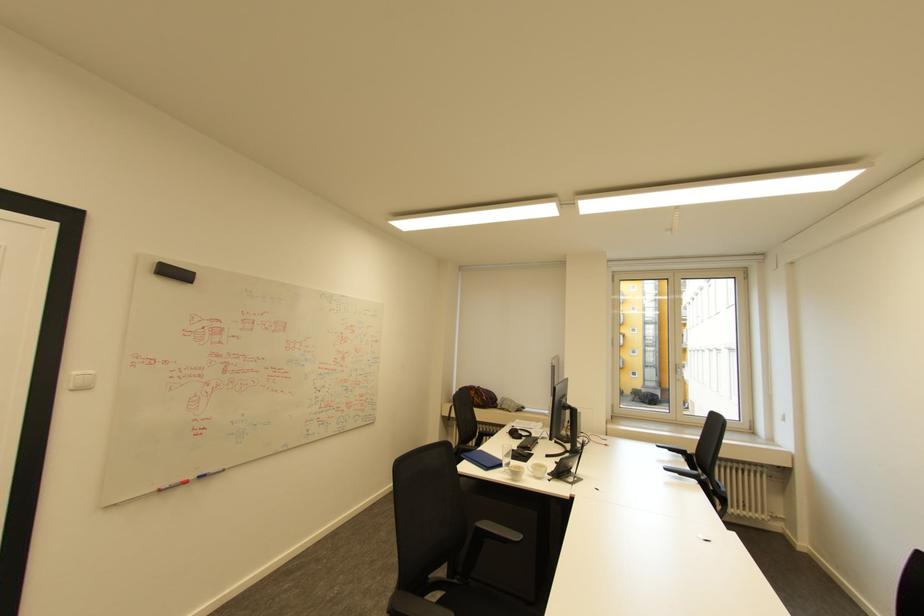
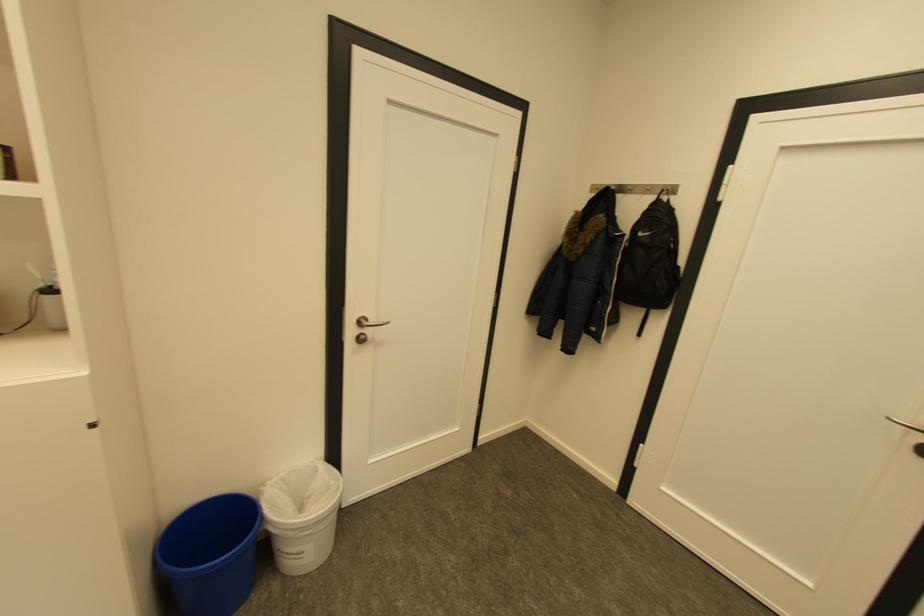
Question: The camera is either moving clockwise (left) or counter-clockwise (right) around the object. The first image is from the beginning of the video and the second image is from the end. Is the camera moving left or right when shooting the video?

Choices:
 (A) Left
 (B) Right

Answer: (B)